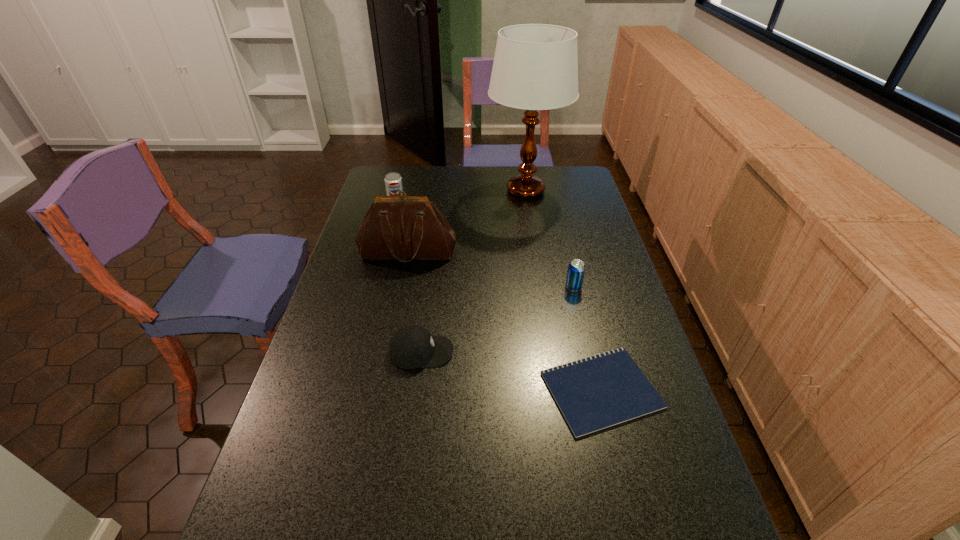
The image size is (960, 540). What are the coordinates of `object that is positioned at the far right corner` in the screenshot? It's located at (535, 67).

Find the location of a particular element. Image resolution: width=960 pixels, height=540 pixels. vacant space at the far edge is located at coordinates (418, 183).

Locate an element on the screen. vacant region at the left edge is located at coordinates (315, 409).

Locate an element on the screen. free spot at the right edge of the desktop is located at coordinates (591, 231).

Where is `vacant area at the far left corner of the desktop`? vacant area at the far left corner of the desktop is located at coordinates (383, 167).

In the image, there is a desktop. Find the location of `vacant space at the far right corner`. vacant space at the far right corner is located at coordinates coord(588,193).

Identify the location of free space between the second shortest object and the shortest object. The height and width of the screenshot is (540, 960). (511, 371).

The image size is (960, 540). Find the location of `free space that is in between the fourth farthest object and the second shortest object`. free space that is in between the fourth farthest object and the second shortest object is located at coordinates (497, 320).

This screenshot has width=960, height=540. In order to click on vacant area that lies between the fourth nearest object and the fifth tallest object in this screenshot , I will do `click(415, 302)`.

Locate an element on the screen. This screenshot has width=960, height=540. empty space between the notepad and the fourth nearest object is located at coordinates (504, 321).